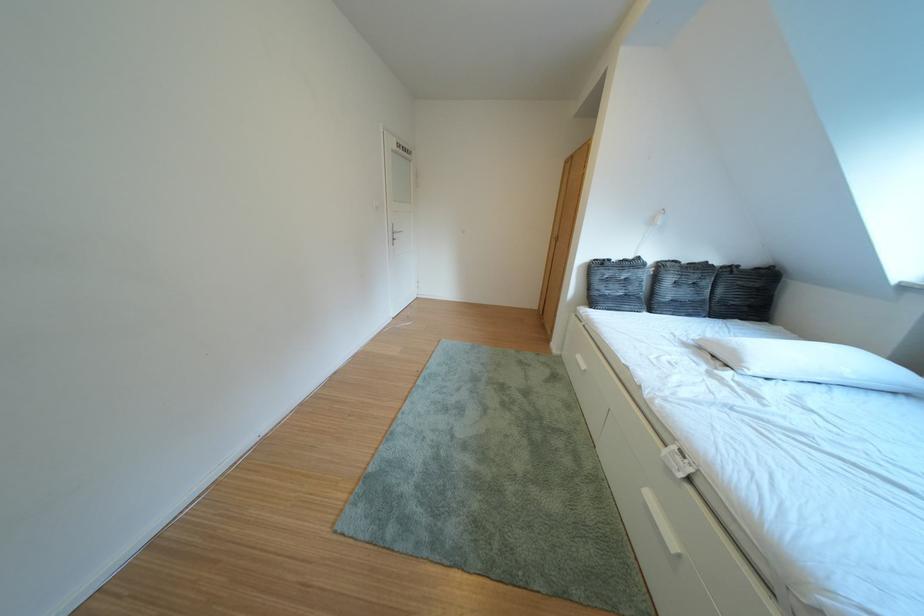
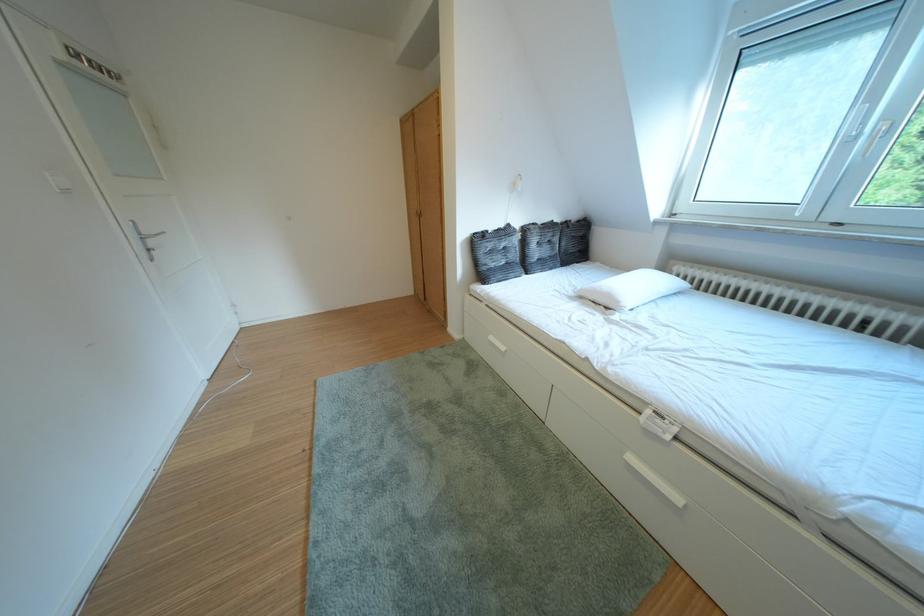
The point at (748, 358) is marked in the first image. Where is the corresponding point in the second image?

(623, 301)